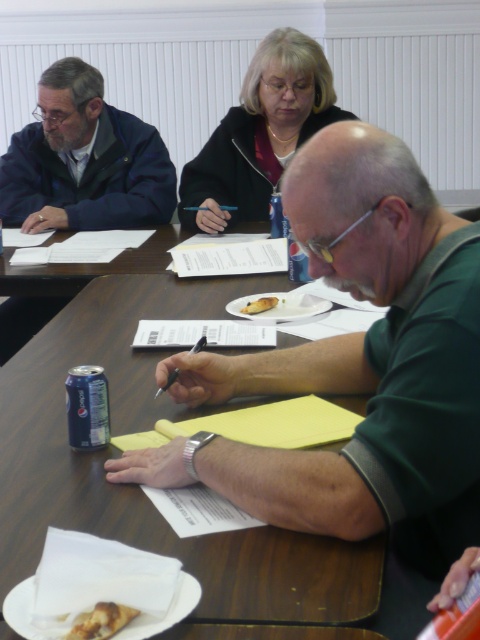
You are an observer looking at the scene. There is a green matte shirt at center and a black plastic pen at center. Which object is closer to the top of the image?

The green matte shirt at center is located above the black plastic pen at center, so it is closer to the top of the image.

From the picture: Based on the coordinates provided, which object is located at point [359,374] in the image?

The point [359,374] corresponds to the green matte shirt at center.